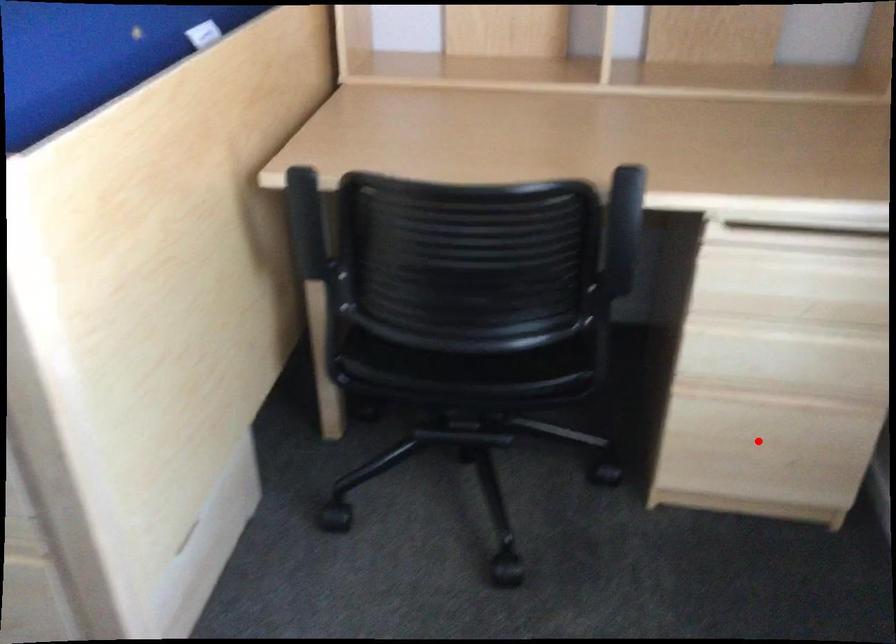
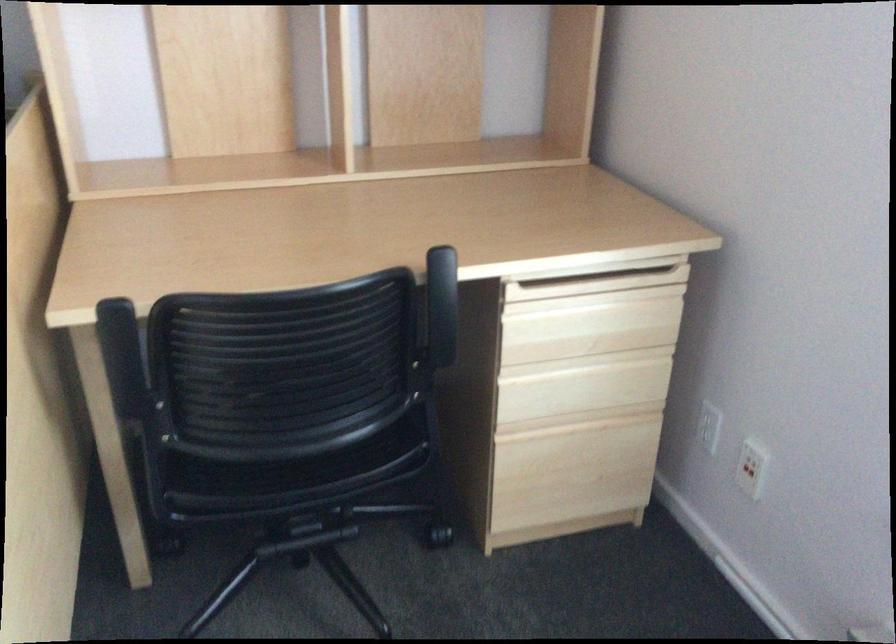
Where in the second image is the point corresponding to the highlighted location from the first image?

(574, 465)